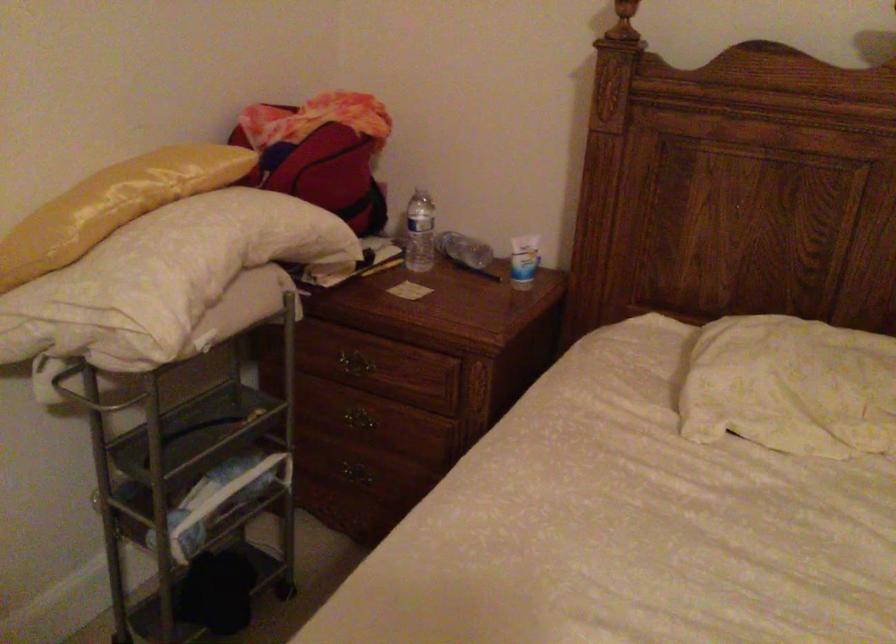
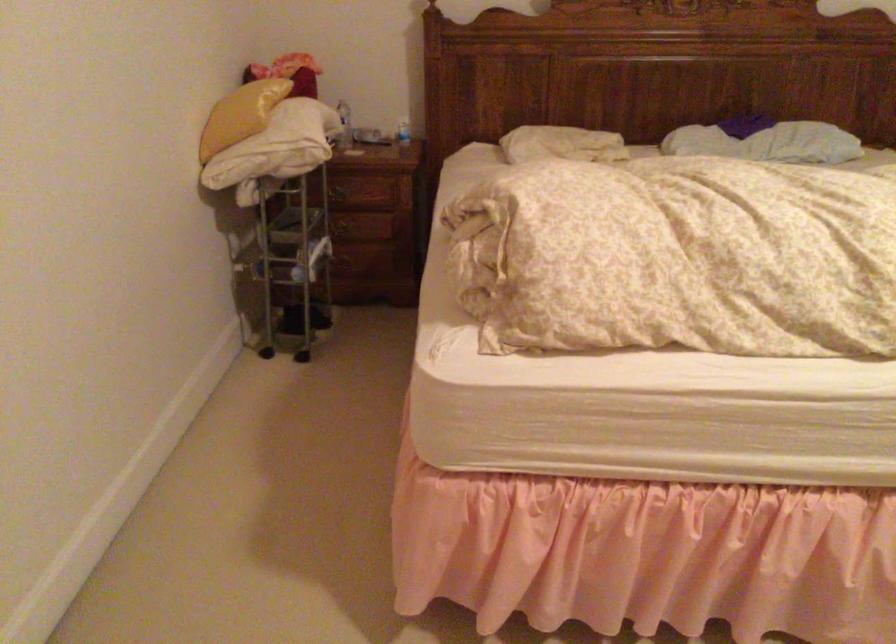
Locate, in the second image, the point that corresponds to (x=346, y=426) in the first image.

(342, 230)